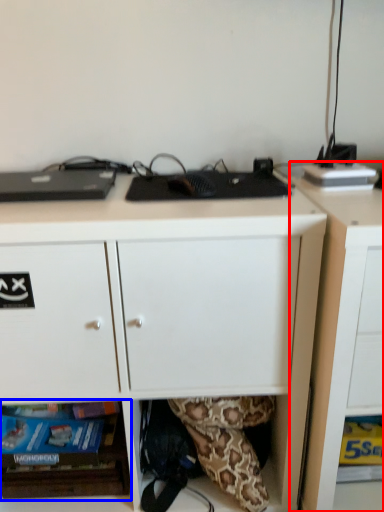
Question: Which point is further to the camera, cabinetry (highlighted by a red box) or shelf (highlighted by a blue box)?

Choices:
 (A) cabinetry
 (B) shelf

Answer: (B)